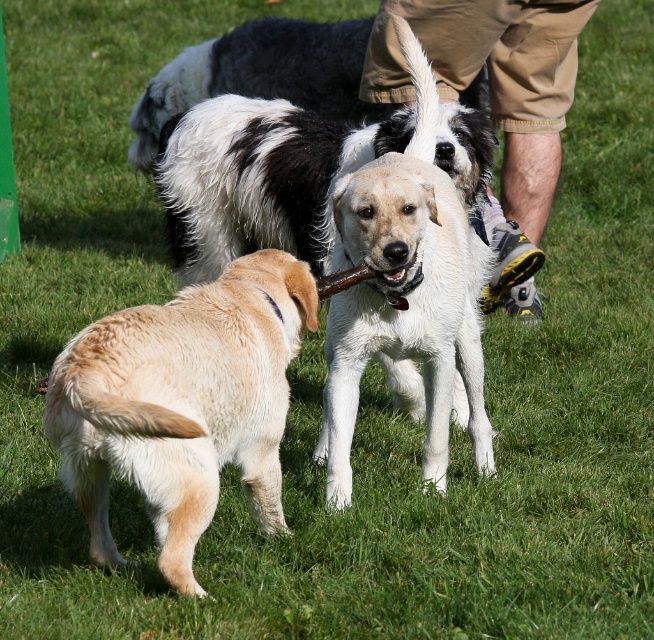
Can you confirm if khaki shorts at center is wider than smooth brown bone at center?

Yes, khaki shorts at center is wider than smooth brown bone at center.

Between khaki shorts at center and smooth brown bone at center, which one is positioned higher?

Positioned higher is khaki shorts at center.

Describe the element at coordinates (494, 80) in the screenshot. I see `khaki shorts at center` at that location.

Identify the location of khaki shorts at center. Image resolution: width=654 pixels, height=640 pixels. (494, 80).

This screenshot has width=654, height=640. Find the location of `golden fur dog at center`. golden fur dog at center is located at coordinates (182, 403).

Is golden fur dog at center behind khaki shorts at center?

No.

Who is more forward, (x=78, y=368) or (x=572, y=49)?

Point (x=78, y=368) is in front.

Image resolution: width=654 pixels, height=640 pixels. I want to click on golden fur dog at center, so click(x=182, y=403).

Is white matte dog at center positioned in front of khaki shorts at center?

That is True.

Find the location of `white matte dog at center`. white matte dog at center is located at coordinates (405, 296).